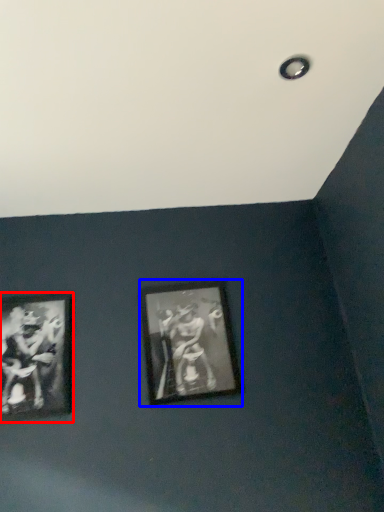
Question: Which point is closer to the camera, picture frame (highlighted by a red box) or picture frame (highlighted by a blue box)?

Choices:
 (A) picture frame
 (B) picture frame

Answer: (A)